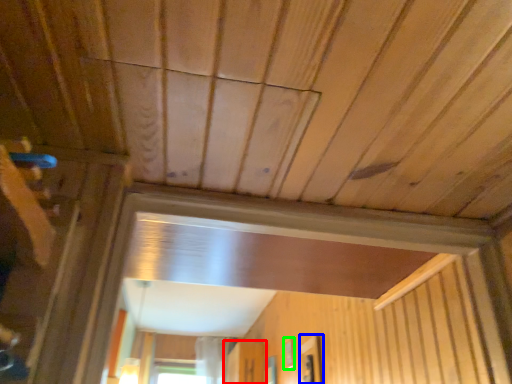
Question: Considering the real-world distances, which object is closest to screen door (highlighted by a red box)? window (highlighted by a blue box) or window (highlighted by a green box).

Choices:
 (A) window
 (B) window

Answer: (B)